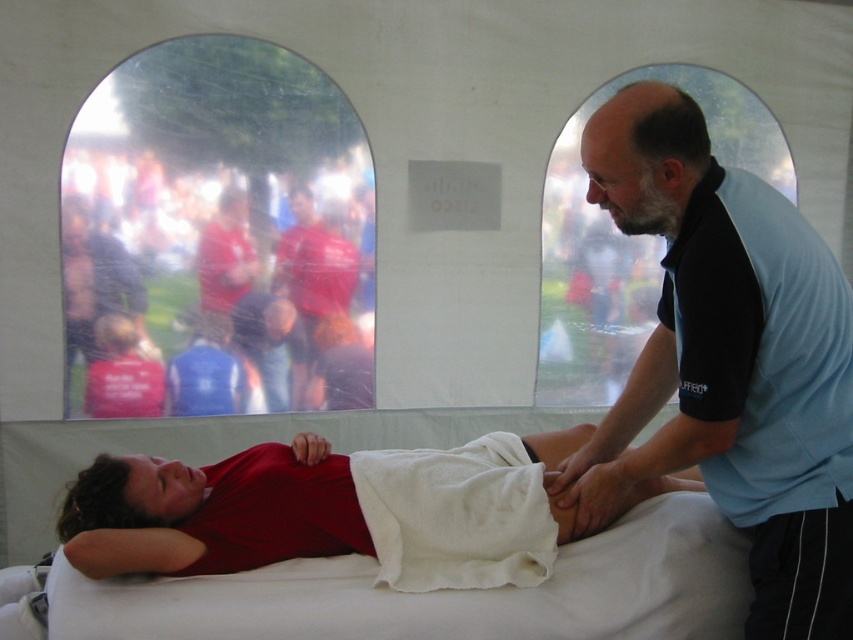
Who is taller, white soft cloth at center or red fabric shirt at center?

red fabric shirt at center

Between white soft cloth at center and red fabric shirt at center, which one has less height?

white soft cloth at center is shorter.

Is point (531, 470) behind point (277, 241)?

No, (531, 470) is in front of (277, 241).

Where is `white soft cloth at center`? white soft cloth at center is located at coordinates (456, 515).

Can you confirm if red smooth shirt at center is bigger than red fabric shirt at center?

Correct, red smooth shirt at center is larger in size than red fabric shirt at center.

Between red smooth shirt at center and red fabric shirt at center, which one is positioned lower?

red smooth shirt at center is below.

The height and width of the screenshot is (640, 853). Identify the location of red smooth shirt at center. pos(329,509).

The width and height of the screenshot is (853, 640). I want to click on red smooth shirt at center, so click(329, 509).

Can you confirm if blue shirt at upper right is positioned to the right of red fabric shirt at center?

Correct, you'll find blue shirt at upper right to the right of red fabric shirt at center.

Measure the distance between blue shirt at upper right and camera.

The distance of blue shirt at upper right from camera is 5.20 feet.

Is point (675, 220) positioned behind point (335, 324)?

No, (675, 220) is in front of (335, 324).

This screenshot has height=640, width=853. Find the location of `blue shirt at upper right`. blue shirt at upper right is located at coordinates (729, 362).